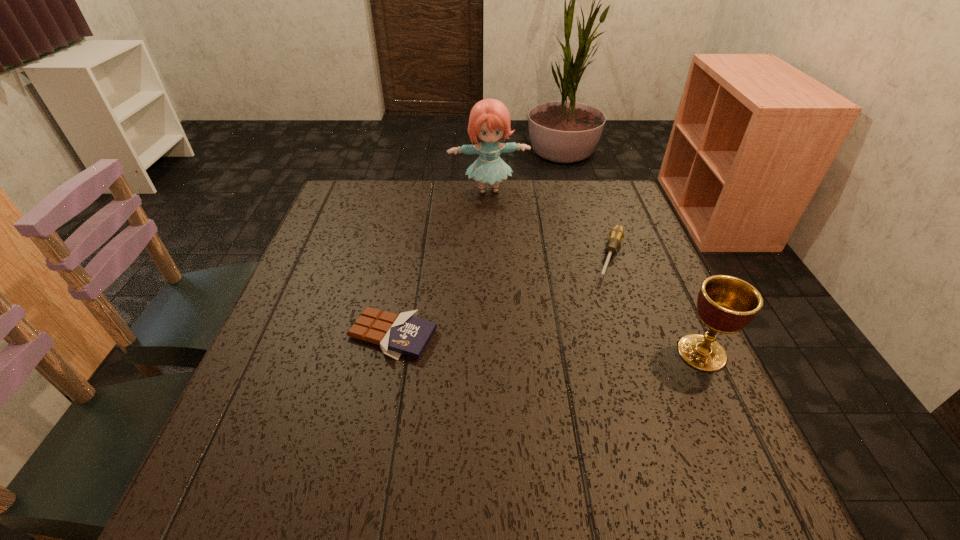
At what (x,y) coordinates should I click in order to perform the action: click on free spot between the chalice and the doll. Please return your answer as a coordinate pair (x, y). The image size is (960, 540). Looking at the image, I should click on (595, 272).

You are a GUI agent. You are given a task and a screenshot of the screen. Output one action in this format:
    pyautogui.click(x=<x>, y=<y>)
    Task: Click on the free space between the doll and the third shortest object
    This screenshot has width=960, height=540.
    Given the screenshot: What is the action you would take?
    pyautogui.click(x=595, y=272)

The width and height of the screenshot is (960, 540). In order to click on free spot between the second shortest object and the rightmost object in this screenshot , I will do `click(657, 305)`.

Locate an element on the screen. The width and height of the screenshot is (960, 540). free space between the rightmost object and the chocolate bar is located at coordinates (547, 343).

Identify the location of object that is the third closest to the doll. pos(726,304).

Identify the location of object that is the third closest to the shortest object. The image size is (960, 540). (726, 304).

Where is `vacant region that satisfies the following two spatial constraints: 1. on the back side of the chocolate bar; 2. on the right side of the farthest object`? This screenshot has width=960, height=540. vacant region that satisfies the following two spatial constraints: 1. on the back side of the chocolate bar; 2. on the right side of the farthest object is located at coordinates (420, 190).

The image size is (960, 540). What are the coordinates of `vacant region that satisfies the following two spatial constraints: 1. on the front side of the chalice; 2. on the left side of the chocolate bar` in the screenshot? It's located at (389, 353).

Identify the location of free space that satisfies the following two spatial constraints: 1. on the back side of the shortest object; 2. on the right side of the farthest object. This screenshot has width=960, height=540. (420, 190).

This screenshot has height=540, width=960. Identify the location of vacant point that satisfies the following two spatial constraints: 1. on the front side of the chalice; 2. on the left side of the third tallest object. (644, 353).